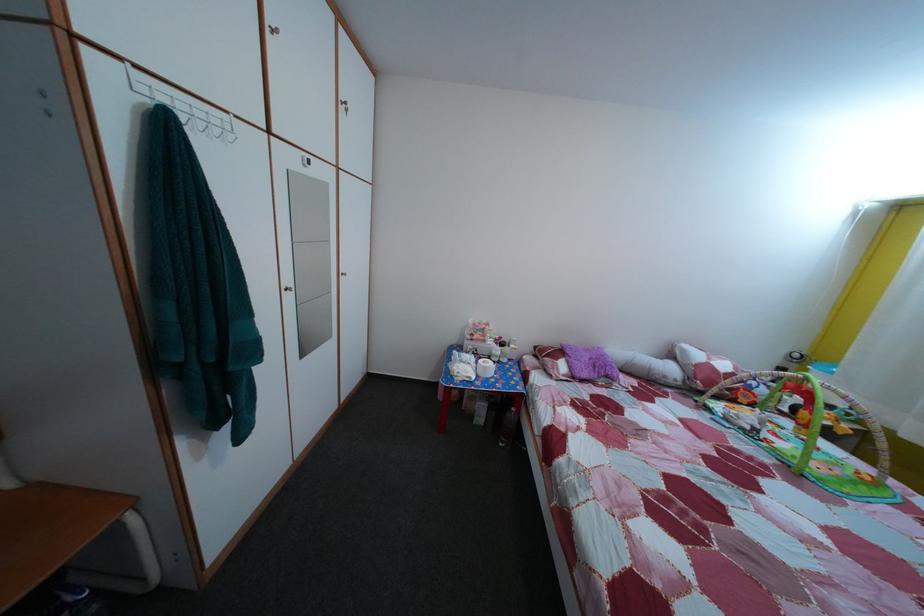
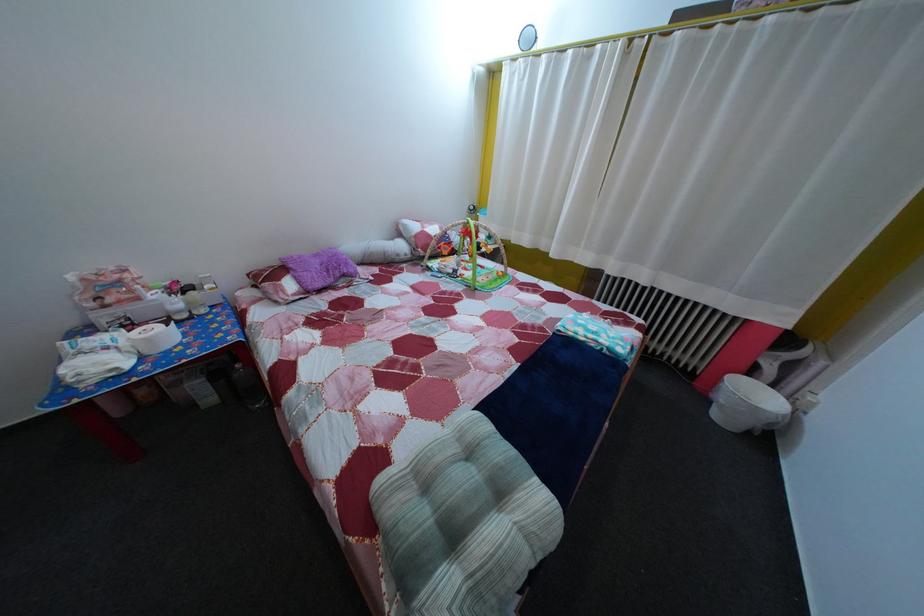
Where in the second image is the point corresponding to point 494,376 from the first image?

(157, 347)